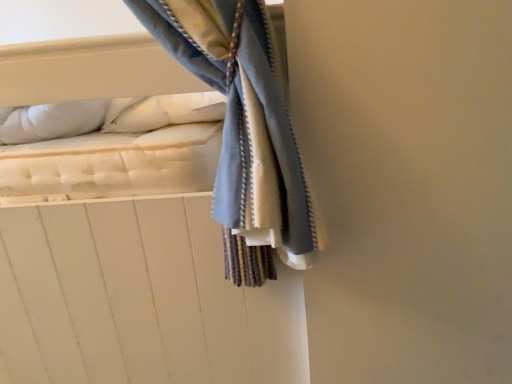
In order to click on satin blue curtain at upper center in this screenshot , I will do pos(136,281).

Describe the element at coordinates (136, 281) in the screenshot. I see `satin blue curtain at upper center` at that location.

Image resolution: width=512 pixels, height=384 pixels. I want to click on satin blue curtain at upper center, so click(136, 281).